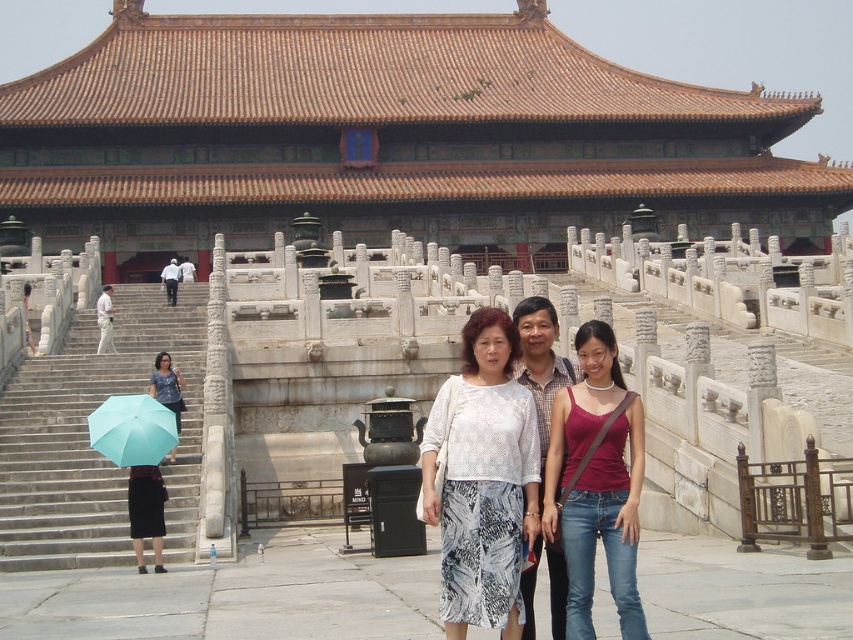
You are standing in front of the Forbidden City building and see the white lace blouse at center. If you want to take a closer photo of the blouse without moving, which direction should you zoom your camera lens?

To take a closer photo of the white lace blouse at center without moving, you should zoom your camera lens in because the blouse is 21.13 meters away from you.